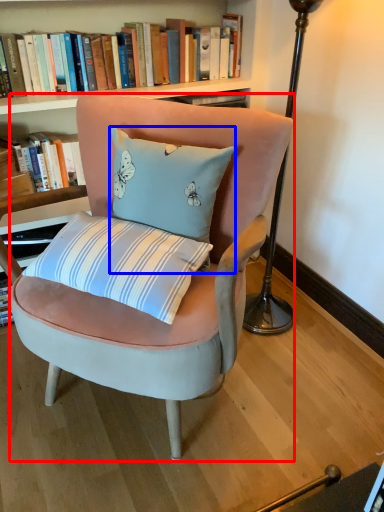
Question: Among these objects, which one is farthest to the camera, chair (highlighted by a red box) or pillow (highlighted by a blue box)?

Choices:
 (A) chair
 (B) pillow

Answer: (B)